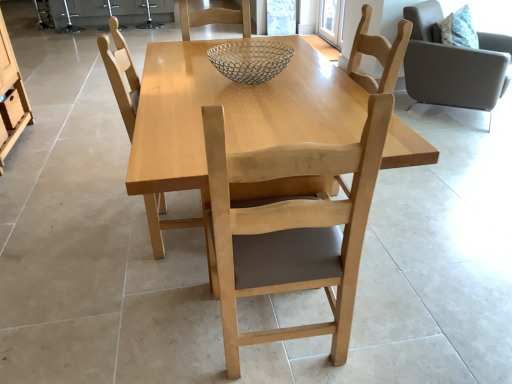
Question: From their relative heights in the image, would you say metallic wire mesh bowl at center is taller or shorter than light brown wood chair at right, which appears as the first chair when viewed from the back?

Choices:
 (A) tall
 (B) short

Answer: (B)

Question: Considering the positions of metallic wire mesh bowl at center and light brown wood chair at right, which is the first chair in right-to-left order, in the image, is metallic wire mesh bowl at center bigger or smaller than light brown wood chair at right, which is the first chair in right-to-left order,?

Choices:
 (A) small
 (B) big

Answer: (A)

Question: Based on their relative distances, which object is farther from the light wood table at center?

Choices:
 (A) light brown wood chair at right, which is the 3th chair in front-to-back order
 (B) light wood chair at center, which is counted as the second chair, starting from the front
 (C) transparent glass window screen at upper center
 (D) light wood chair at center, the 2th chair when ordered from left to right
 (E) metallic wire mesh bowl at center

Answer: (C)

Question: Estimate the real-world distances between objects in this image. Which object is farther from the light wood chair at center, the 2th chair positioned from the back?

Choices:
 (A) metallic wire mesh bowl at center
 (B) matte wood drawer at left
 (C) light brown wood chair at right, which is the 3th chair in front-to-back order
 (D) light wood table at center
 (E) transparent glass window screen at upper center

Answer: (C)